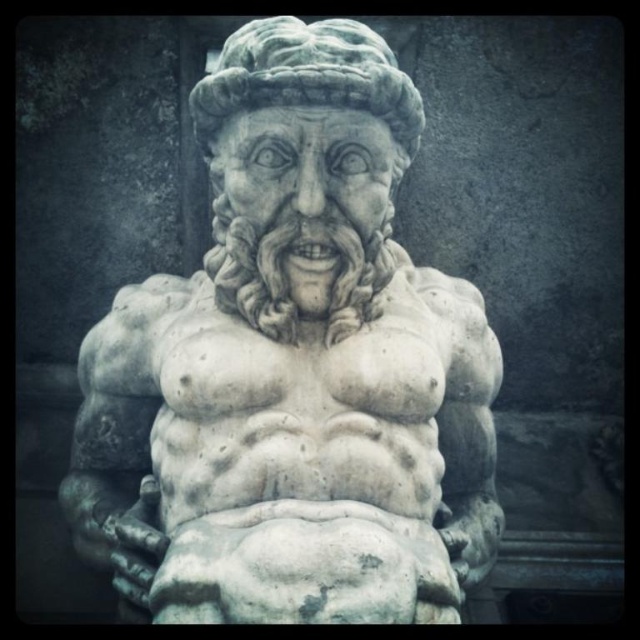
Looking at this image, you are standing in front of a statue and want to know what is at the center of the image. According to the coordinates given, what is located at point (292, 369)?

The point (292, 369) marks the white marble statue at center.

You are standing in front of the stone statue and notice two points marked on its surface. The first point is at coordinates point (282, 209) and the second at point (298, 28). Which of these points is nearer to you?

Point (282, 209) is closer to the viewer than point (298, 28).